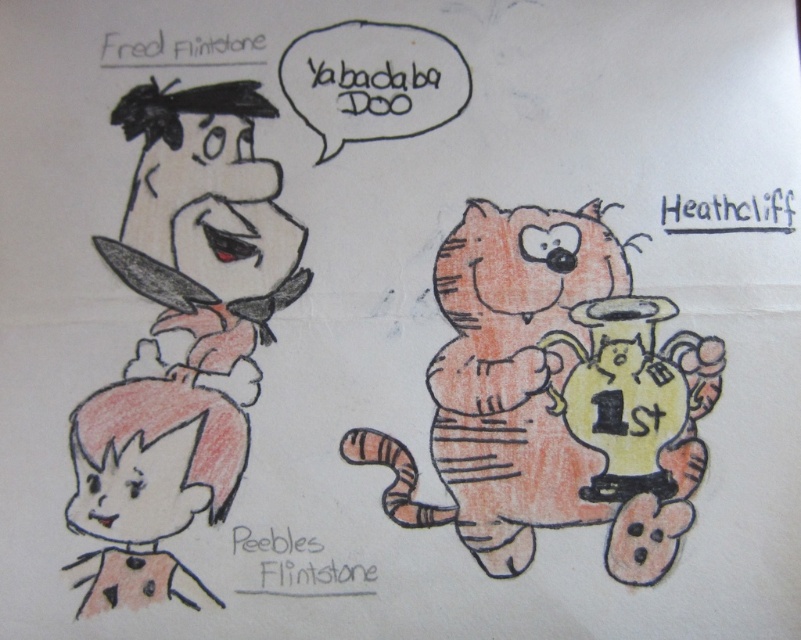
Is orange striped cat at right wider than matte pink hair at lower left?

Correct, the width of orange striped cat at right exceeds that of matte pink hair at lower left.

Measure the distance between point (570,225) and camera.

Point (570,225) and camera are 1.21 meters apart from each other.

At what (x,y) coordinates should I click in order to perform the action: click on orange striped cat at right. Please return your answer as a coordinate pair (x, y). The width and height of the screenshot is (801, 640). Looking at the image, I should click on (554, 396).